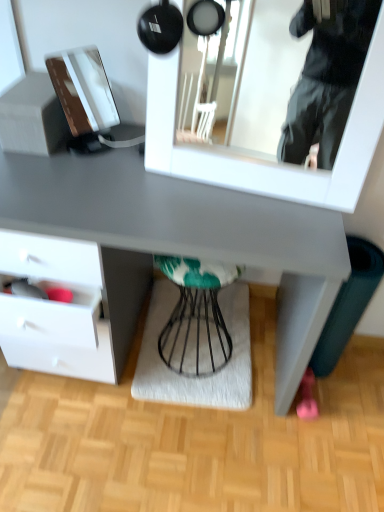
Question: From the image's perspective, is white glossy mirror at upper center located beneath textured gray mat at center?

Choices:
 (A) no
 (B) yes

Answer: (A)

Question: Considering the relative sizes of white glossy mirror at upper center and textured gray mat at center in the image provided, is white glossy mirror at upper center thinner than textured gray mat at center?

Choices:
 (A) no
 (B) yes

Answer: (B)

Question: Are white glossy mirror at upper center and textured gray mat at center located far from each other?

Choices:
 (A) yes
 (B) no

Answer: (A)

Question: From a real-world perspective, is white glossy mirror at upper center on textured gray mat at center?

Choices:
 (A) no
 (B) yes

Answer: (B)

Question: From the image's perspective, is white glossy mirror at upper center on textured gray mat at center?

Choices:
 (A) no
 (B) yes

Answer: (B)

Question: From the image's perspective, relative to white glossy mirror at upper center, is textured gray mat at center above or below?

Choices:
 (A) above
 (B) below

Answer: (B)

Question: Based on their sizes in the image, would you say textured gray mat at center is bigger or smaller than white glossy mirror at upper center?

Choices:
 (A) small
 (B) big

Answer: (A)

Question: Is textured gray mat at center inside the boundaries of white glossy mirror at upper center, or outside?

Choices:
 (A) outside
 (B) inside

Answer: (A)

Question: From their relative heights in the image, would you say textured gray mat at center is taller or shorter than white glossy mirror at upper center?

Choices:
 (A) tall
 (B) short

Answer: (B)

Question: Does point (324, 88) appear closer or farther from the camera than point (218, 300)?

Choices:
 (A) closer
 (B) farther

Answer: (B)

Question: Is white glossy mirror at upper center wider or thinner than textured gray mat at center?

Choices:
 (A) thin
 (B) wide

Answer: (A)

Question: From a real-world perspective, relative to textured gray mat at center, is white glossy mirror at upper center vertically above or below?

Choices:
 (A) above
 (B) below

Answer: (A)

Question: Considering the positions of white glossy mirror at upper center and textured gray mat at center in the image, is white glossy mirror at upper center bigger or smaller than textured gray mat at center?

Choices:
 (A) big
 (B) small

Answer: (A)

Question: Is white glossy mirror at upper center taller or shorter than teal fabric stool at center?

Choices:
 (A) tall
 (B) short

Answer: (B)

Question: Would you say white glossy mirror at upper center is inside or outside teal fabric stool at center?

Choices:
 (A) inside
 (B) outside

Answer: (B)